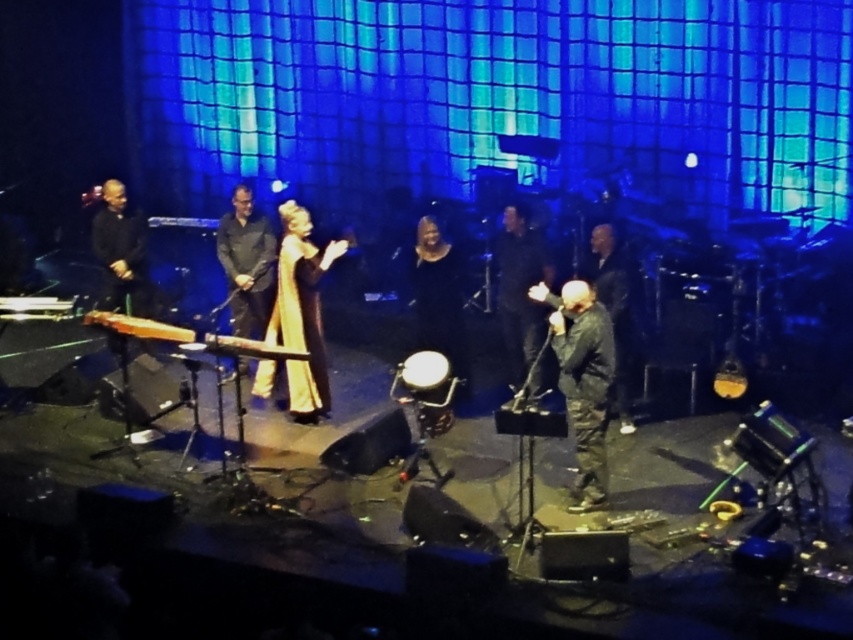
Which is above, dark gray leather jacket at center or camouflage jacket at center?

camouflage jacket at center

Which of these two, dark gray leather jacket at center or camouflage jacket at center, stands shorter?

With less height is dark gray leather jacket at center.

This screenshot has width=853, height=640. In order to click on dark gray leather jacket at center in this screenshot , I will do `click(582, 381)`.

The image size is (853, 640). I want to click on dark gray leather jacket at center, so click(582, 381).

Is dark gray leather jacket at center thinner than black matte shirt at center?

Indeed, dark gray leather jacket at center has a lesser width compared to black matte shirt at center.

Does dark gray leather jacket at center have a smaller size compared to black matte shirt at center?

Actually, dark gray leather jacket at center might be larger than black matte shirt at center.

In the scene shown: Who is more distant from viewer, (585, 508) or (218, 240)?

The point (218, 240) is more distant.

Image resolution: width=853 pixels, height=640 pixels. What are the coordinates of `dark gray leather jacket at center` in the screenshot? It's located at (582, 381).

Can you confirm if black matte suit at center is thinner than black velvet dress at center?

Correct, black matte suit at center's width is less than black velvet dress at center's.

Who is lower down, black matte suit at center or black velvet dress at center?

black velvet dress at center is lower down.

Is point (505, 228) positioned behind point (451, 360)?

No, it is not.

The width and height of the screenshot is (853, 640). In order to click on black matte suit at center in this screenshot , I will do `click(520, 289)`.